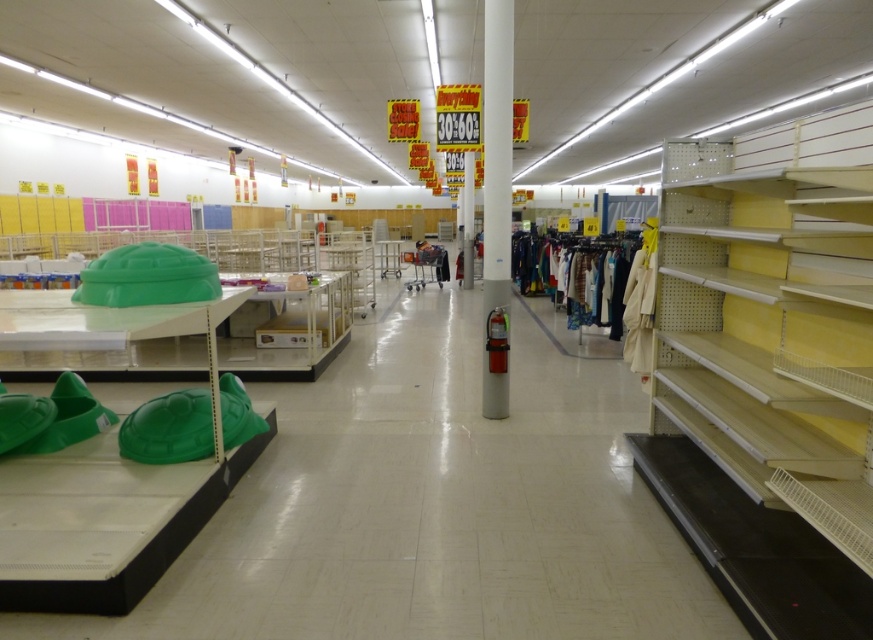
You are a store employee who needs to place a new large promotional poster. You have the metallic yellow shelf at right and the white glossy fire extinguisher at center in your view. Which object should you choose to mount the poster on if you want to ensure it can support the poster without falling?

The metallic yellow shelf at right has a larger size compared to the white glossy fire extinguisher at center, so it is more likely to support the poster without falling.

Looking at this image, you are a store employee who needs to retrieve an item from the metallic yellow shelf at right. However, the white glossy fire extinguisher at center is blocking your path. Can you move the fire extinguisher to access the shelf?

The metallic yellow shelf at right is positioned under the white glossy fire extinguisher at center, so the fire extinguisher is directly above the shelf and cannot be moved to access it.